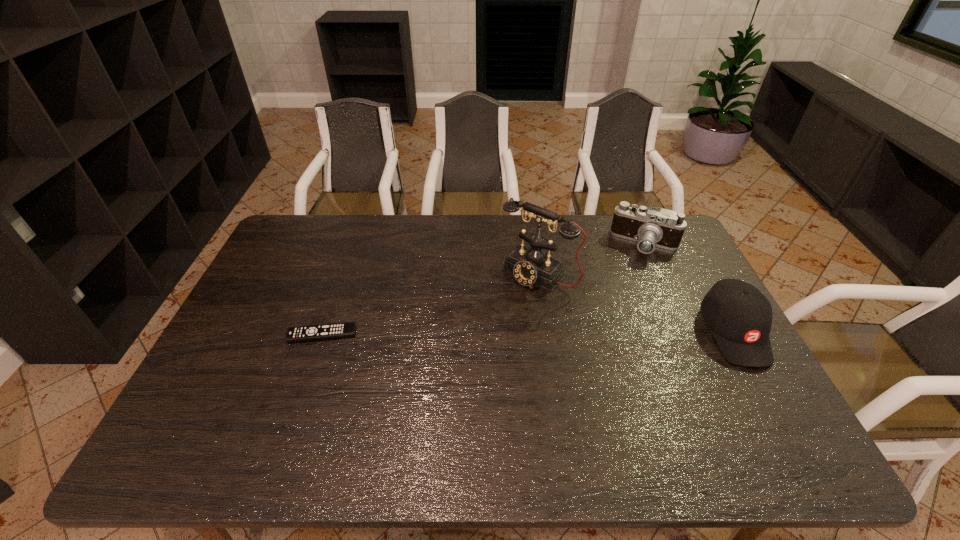
Where is `the leftmost object`? the leftmost object is located at coordinates (346, 329).

At what (x,y) coordinates should I click in order to perform the action: click on the shortest object. Please return your answer as a coordinate pair (x, y). Looking at the image, I should click on (346, 329).

Locate an element on the screen. baseball cap is located at coordinates (739, 316).

At what (x,y) coordinates should I click in order to perform the action: click on the tallest object. Please return your answer as a coordinate pair (x, y). This screenshot has width=960, height=540. Looking at the image, I should click on (530, 266).

The width and height of the screenshot is (960, 540). I want to click on the second object from left to right, so click(530, 266).

What are the coordinates of `camera` in the screenshot? It's located at (651, 227).

You are a GUI agent. You are given a task and a screenshot of the screen. Output one action in this format:
    pyautogui.click(x=<x>, y=<y>)
    Task: Click on the free space located on the back of the shortest object
    Image resolution: width=960 pixels, height=540 pixels.
    Given the screenshot: What is the action you would take?
    (x=338, y=289)

This screenshot has height=540, width=960. What are the coordinates of `free region located with a logo on the front of the baseball cap` in the screenshot? It's located at (772, 400).

Where is `vacant space situated on the dial of the tallest object`? vacant space situated on the dial of the tallest object is located at coordinates (450, 362).

Identify the location of free space located on the dial of the tallest object. (439, 375).